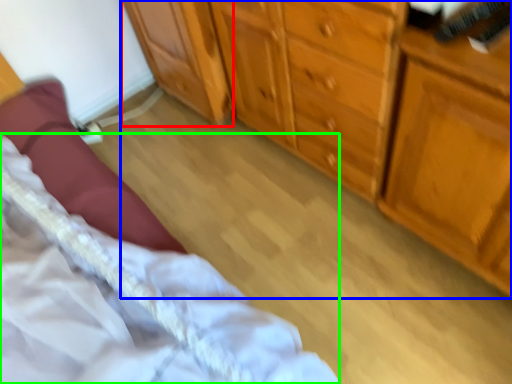
Question: Which is farther away from cabinetry (highlighted by a red box)? chest of drawers (highlighted by a blue box) or bed (highlighted by a green box)?

Choices:
 (A) chest of drawers
 (B) bed

Answer: (B)